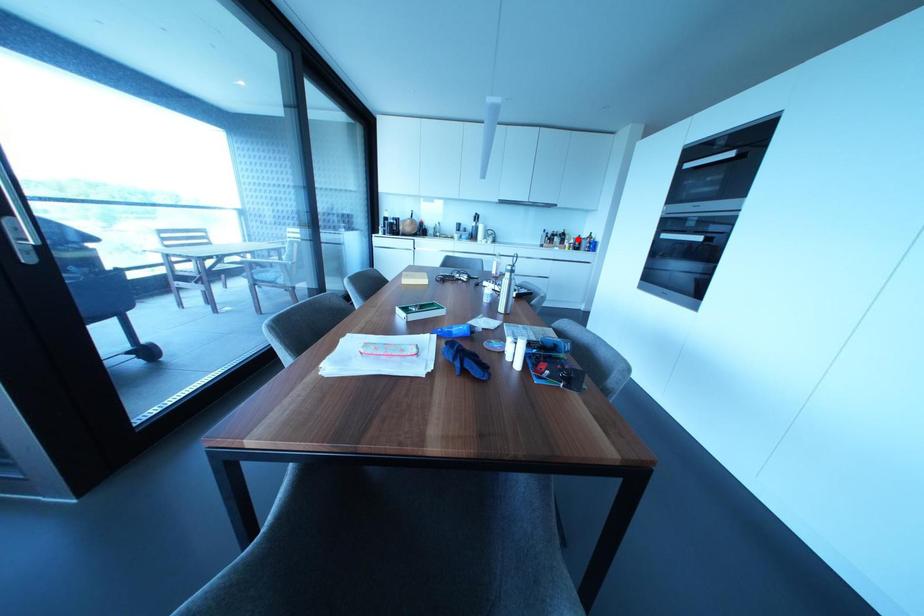
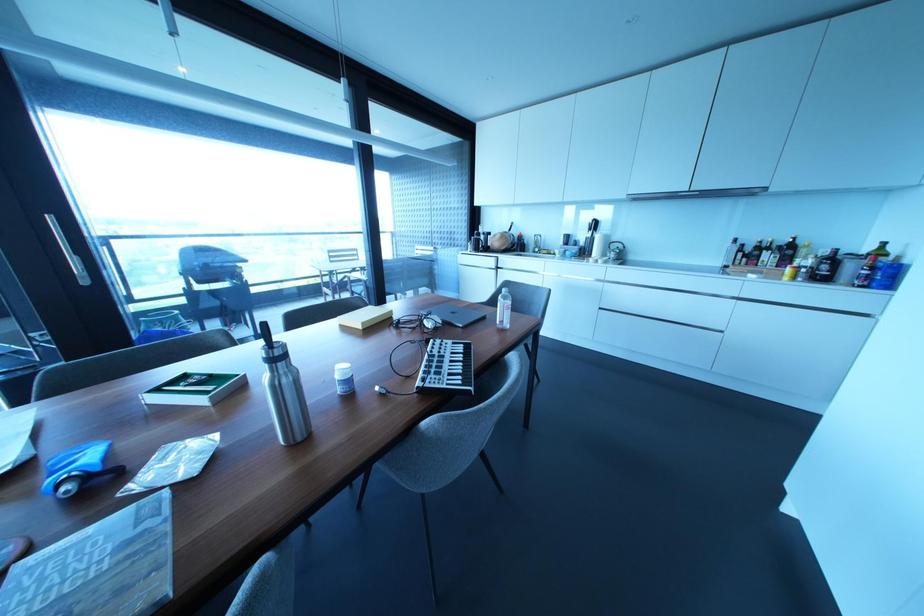
The point at the highlighted location is marked in the first image. Where is the corresponding point in the second image?

(833, 257)